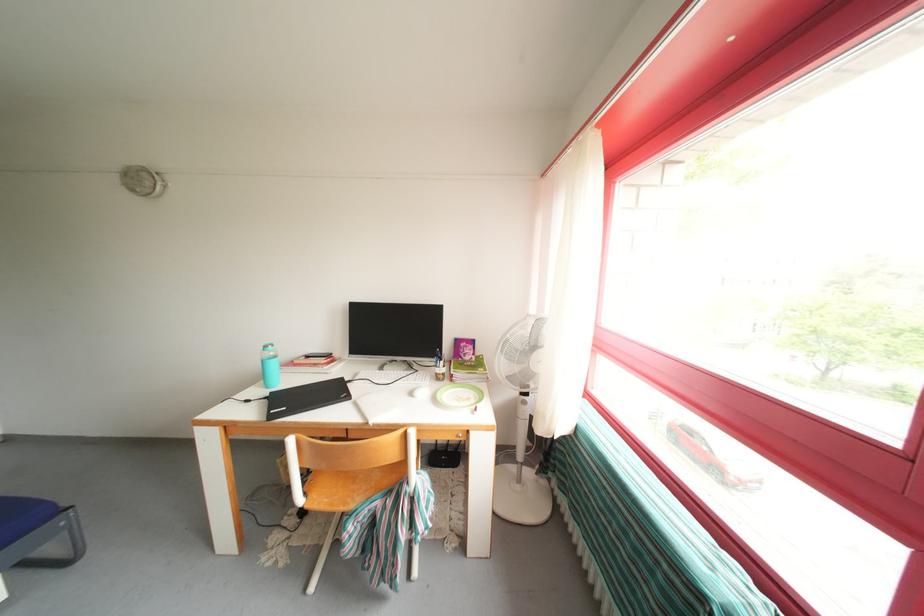
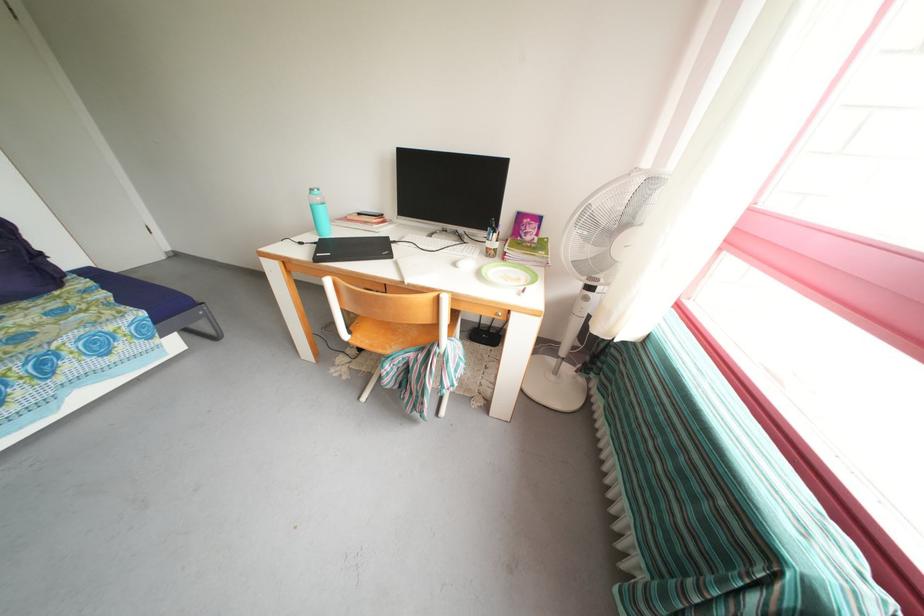
The point at (274, 352) is marked in the first image. Where is the corresponding point in the second image?

(319, 196)